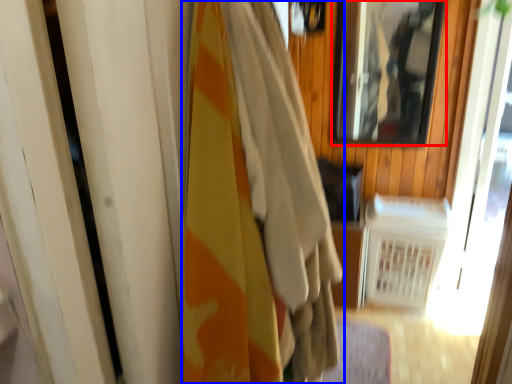
Question: Which of the following is the farthest to the observer, mirror (highlighted by a red box) or curtain (highlighted by a blue box)?

Choices:
 (A) mirror
 (B) curtain

Answer: (A)